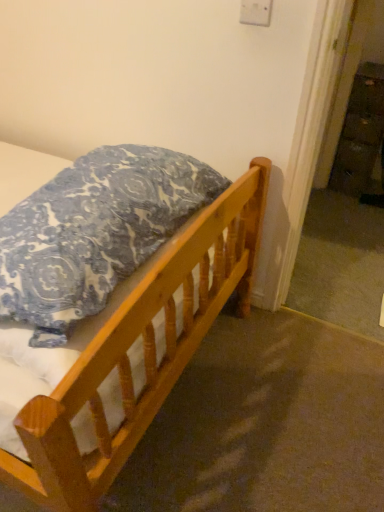
Question: Is blue patterned pillow at upper left further to camera compared to wooden dresser at right?

Choices:
 (A) yes
 (B) no

Answer: (B)

Question: Does blue patterned pillow at upper left have a smaller size compared to wooden dresser at right?

Choices:
 (A) no
 (B) yes

Answer: (A)

Question: Would you say wooden dresser at right is part of blue patterned pillow at upper left's contents?

Choices:
 (A) no
 (B) yes

Answer: (A)

Question: Does blue patterned pillow at upper left have a larger size compared to wooden dresser at right?

Choices:
 (A) yes
 (B) no

Answer: (A)

Question: Is blue patterned pillow at upper left in front of wooden dresser at right?

Choices:
 (A) yes
 (B) no

Answer: (A)

Question: From the image's perspective, would you say blue patterned pillow at upper left is shown under wooden dresser at right?

Choices:
 (A) no
 (B) yes

Answer: (B)

Question: Is blue patterned pillow at upper left wider than wooden bed at lower left?

Choices:
 (A) yes
 (B) no

Answer: (B)

Question: From a real-world perspective, is blue patterned pillow at upper left physically below wooden bed at lower left?

Choices:
 (A) yes
 (B) no

Answer: (B)

Question: Is blue patterned pillow at upper left positioned with its back to wooden bed at lower left?

Choices:
 (A) no
 (B) yes

Answer: (A)

Question: Is wooden bed at lower left completely or partially inside blue patterned pillow at upper left?

Choices:
 (A) no
 (B) yes

Answer: (A)

Question: From the image's perspective, does blue patterned pillow at upper left appear lower than wooden bed at lower left?

Choices:
 (A) yes
 (B) no

Answer: (B)

Question: Is blue patterned pillow at upper left shorter than wooden bed at lower left?

Choices:
 (A) yes
 (B) no

Answer: (B)

Question: Is wooden dresser at right to the left of wooden bed at lower left from the viewer's perspective?

Choices:
 (A) yes
 (B) no

Answer: (B)